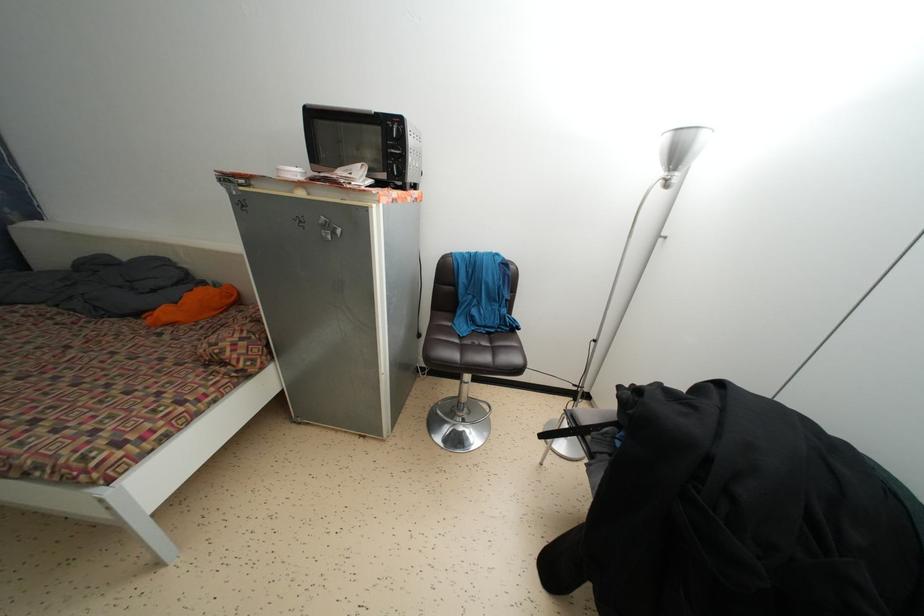
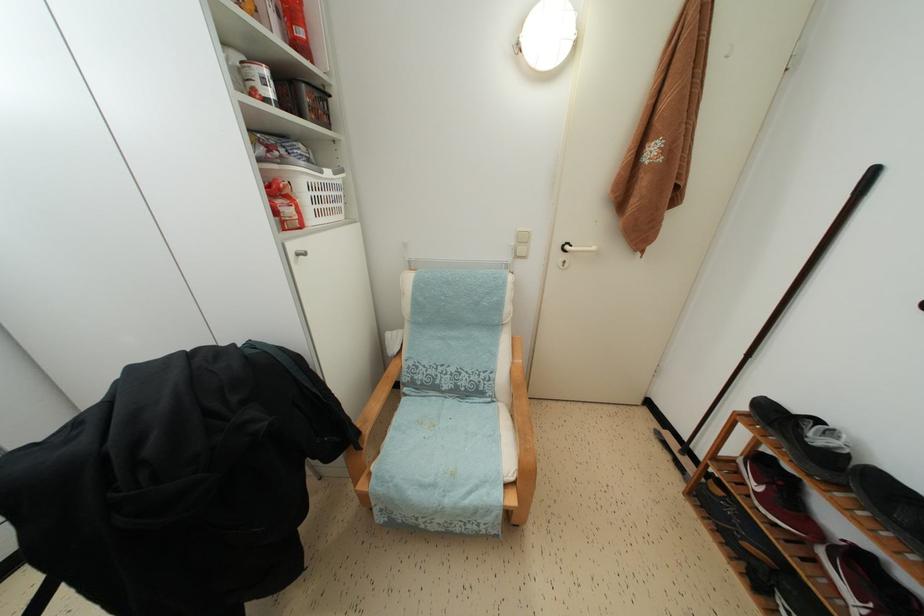
How did the camera likely rotate?

The camera's rotation is toward right-down.